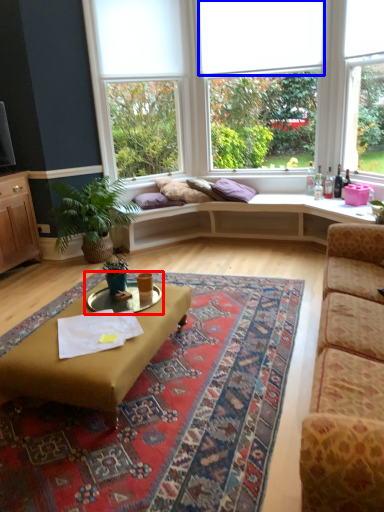
Question: Which object is further to the camera taking this photo, cocktail table (highlighted by a red box) or blind (highlighted by a blue box)?

Choices:
 (A) cocktail table
 (B) blind

Answer: (B)